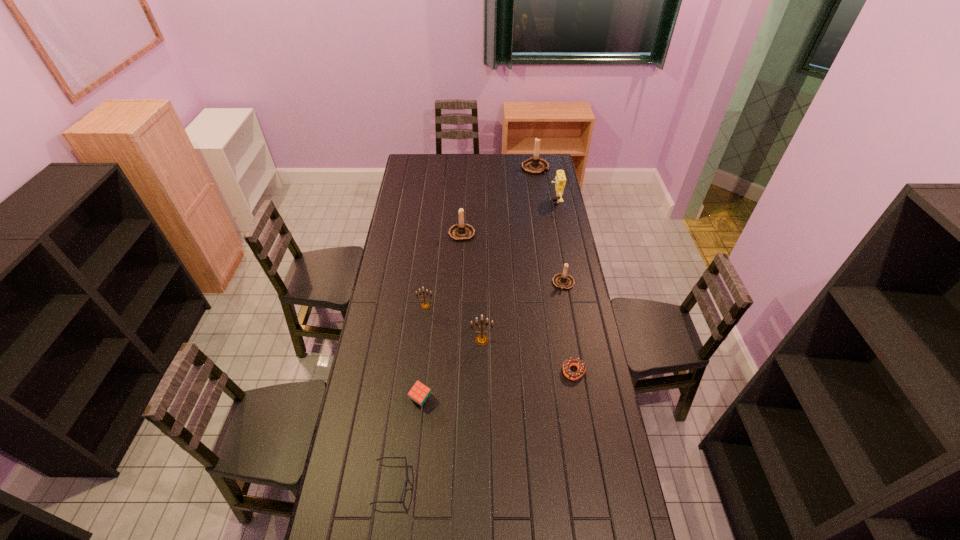
This screenshot has width=960, height=540. I want to click on the farther gold candelabrum, so click(425, 305).

Find the location of a particular element. the seventh tallest object is located at coordinates (419, 393).

You are a GUI agent. You are given a task and a screenshot of the screen. Output one action in this format:
    pyautogui.click(x=<x>, y=<y>)
    Task: Click on the second nearest object
    The image size is (960, 540).
    Given the screenshot: What is the action you would take?
    pyautogui.click(x=419, y=393)

The width and height of the screenshot is (960, 540). Find the location of `spectacles`. spectacles is located at coordinates (407, 480).

You are a GUI agent. You are given a task and a screenshot of the screen. Output one action in this format:
    pyautogui.click(x=<x>, y=<y>)
    Task: Click on the doughnut
    The height and width of the screenshot is (540, 960).
    Given the screenshot: What is the action you would take?
    pyautogui.click(x=572, y=361)

Identify the location of brown doughnut. (572, 361).

Where is `vacant area situated on the front of the tallest candelabrum`? The height and width of the screenshot is (540, 960). vacant area situated on the front of the tallest candelabrum is located at coordinates (538, 181).

Where is `vacant region located on the face of the sponge`? vacant region located on the face of the sponge is located at coordinates (503, 202).

At what (x,y) coordinates should I click in order to perform the action: click on vacant area situated on the face of the sponge. Please return your answer as a coordinate pair (x, y). The width and height of the screenshot is (960, 540). Looking at the image, I should click on (537, 202).

At what (x,y) coordinates should I click in order to perform the action: click on vacant point located on the face of the sponge. Please return your answer as a coordinate pair (x, y). Looking at the image, I should click on (510, 202).